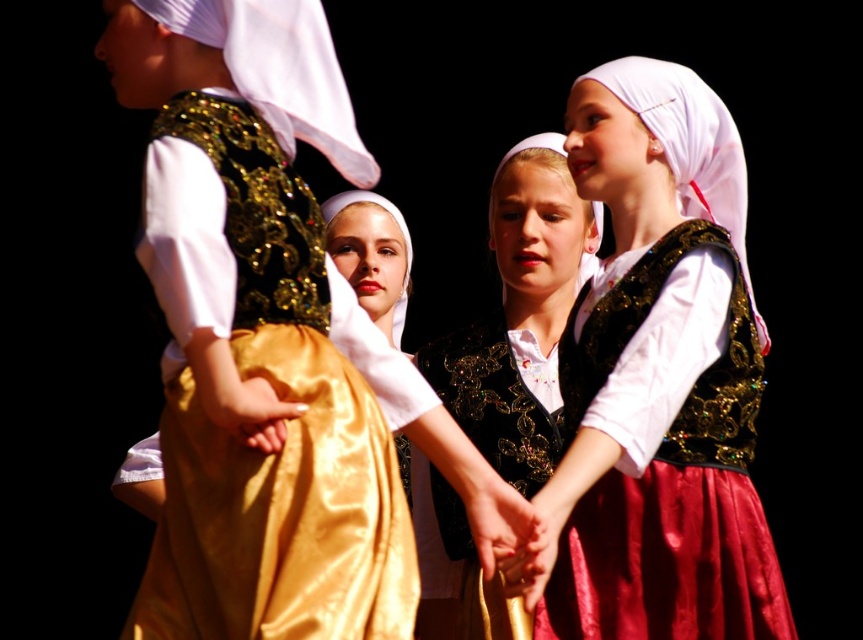
Question: Which object is the farthest from the satin/golden hand at center?

Choices:
 (A) smooth golden fabric hand at center
 (B) satin gold dress at center

Answer: (A)

Question: Is matte black vest at center above smooth golden fabric hand at center?

Choices:
 (A) yes
 (B) no

Answer: (A)

Question: Which object is the closest to the shiny gold skirt at center?

Choices:
 (A) smooth golden fabric at center
 (B) matte black vest at center
 (C) smooth golden fabric hand at center

Answer: (A)

Question: Considering the real-world distances, which object is closest to the matte black vest at center?

Choices:
 (A) shiny gold skirt at center
 (B) satin/golden hand at center

Answer: (A)

Question: Is shiny gold skirt at center to the left of satin/golden hand at center from the viewer's perspective?

Choices:
 (A) no
 (B) yes

Answer: (A)

Question: Is shiny gold skirt at center thinner than satin gold dress at center?

Choices:
 (A) no
 (B) yes

Answer: (A)